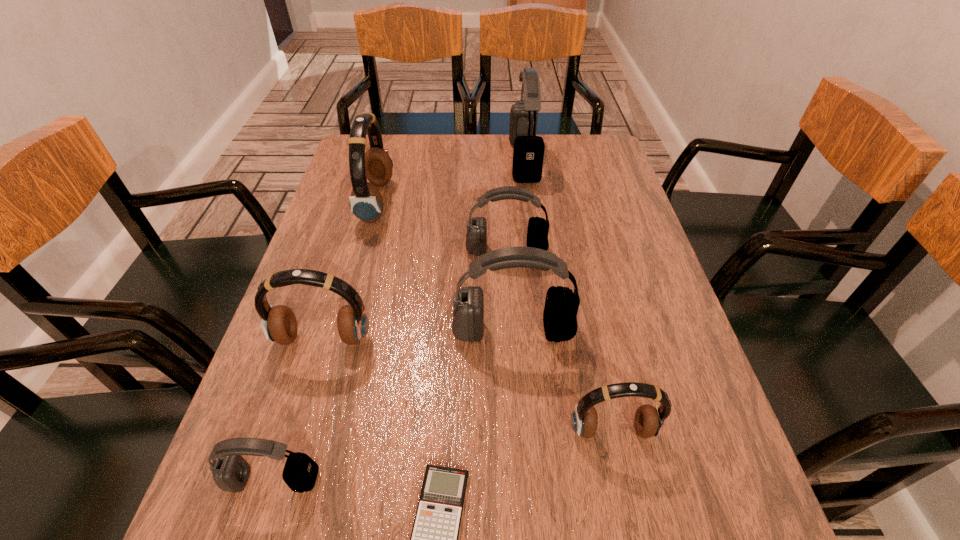
Where is `vacant area between the farthest black headset and the third farthest black headset`? This screenshot has width=960, height=540. vacant area between the farthest black headset and the third farthest black headset is located at coordinates click(518, 246).

What are the coordinates of `empty space between the second nearest black headset and the second nearest brown headset` in the screenshot? It's located at (419, 335).

Identify the location of empty space between the third nearest object and the biggest brown headset. (494, 316).

Identify the location of vacant space that's between the third biggest black headset and the second nearest brown headset. Image resolution: width=960 pixels, height=540 pixels. (415, 295).

Locate an element on the screen. vacant space that is in between the third farthest black headset and the smallest brown headset is located at coordinates coord(563,381).

Locate an element on the screen. The width and height of the screenshot is (960, 540). vacant space that is in between the biggest brown headset and the nearest black headset is located at coordinates (324, 341).

I want to click on object identified as the closest to the second nearest brown headset, so click(561, 306).

At what (x,y) coordinates should I click in order to perform the action: click on object that stands as the closest to the third nearest black headset. Please return your answer as a coordinate pair (x, y). Looking at the image, I should click on (561, 306).

The image size is (960, 540). I want to click on headset object that ranks as the fifth closest to the third smallest black headset, so pos(366,203).

Identify which headset is the seventh nearest to the shortest object. Please provide its 2D coordinates. Your answer should be formatted as a tuple, i.e. [(x, y)], where the tuple contains the x and y coordinates of a point satisfying the conditions above.

[(528, 152)]